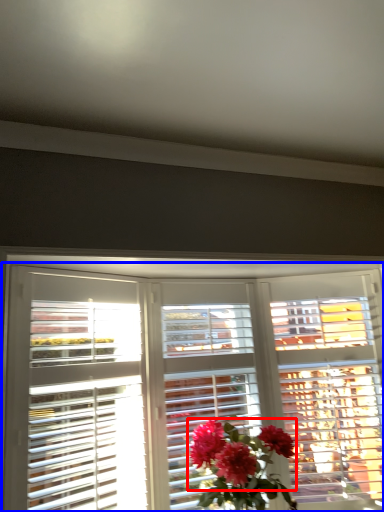
Question: Which point is closer to the camera, flower (highlighted by a red box) or window (highlighted by a blue box)?

Choices:
 (A) flower
 (B) window

Answer: (B)